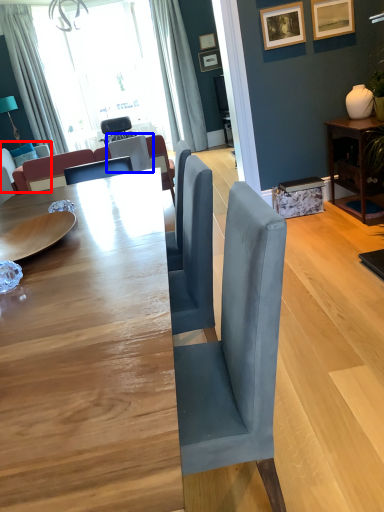
Question: Which object appears farthest to the camera in this image, couch (highlighted by a red box) or chair (highlighted by a blue box)?

Choices:
 (A) couch
 (B) chair

Answer: (A)